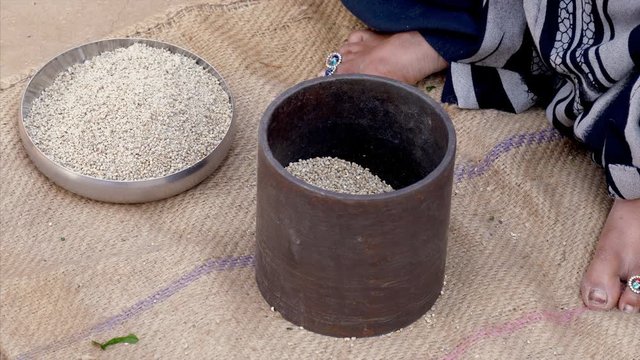
The height and width of the screenshot is (360, 640). I want to click on blanket, so click(204, 240), click(523, 263), click(276, 35), click(260, 331).